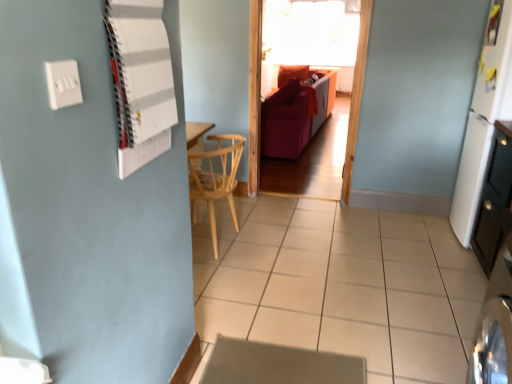
Question: From a real-world perspective, is white plastic switch at upper left physically located above or below white matte board at upper left?

Choices:
 (A) above
 (B) below

Answer: (A)

Question: Considering the positions of white plastic switch at upper left and white matte board at upper left in the image, is white plastic switch at upper left taller or shorter than white matte board at upper left?

Choices:
 (A) tall
 (B) short

Answer: (B)

Question: Estimate the real-world distances between objects in this image. Which object is closer to the white matte board at upper left?

Choices:
 (A) white plastic switch at upper left
 (B) white tile at center
 (C) white matte refrigerator at right
 (D) transparent glass window at upper center
 (E) velvet red couch at center

Answer: (A)

Question: Which of these objects is positioned closest to the white matte refrigerator at right?

Choices:
 (A) white matte board at upper left
 (B) velvet red couch at center
 (C) white glossy dresser at right
 (D) white plastic switch at upper left
 (E) transparent glass window at upper center

Answer: (C)